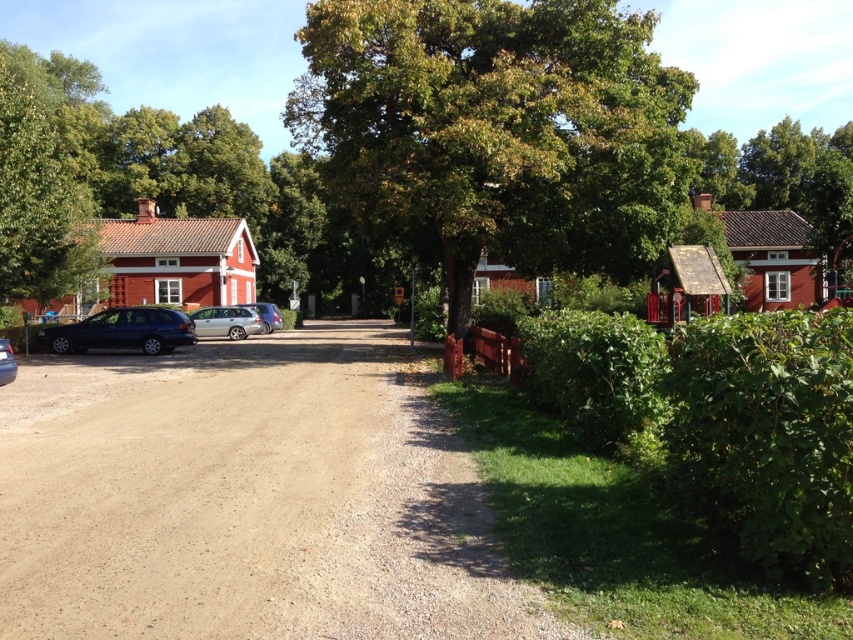
You are a delivery driver trying to park your satin silver car at center on the brown gravel dirt track at lower left. Based on the scene, will the car fit on the track?

The brown gravel dirt track at lower left is shorter than the satin silver car at center, so the car will not fit on the track.

You are a delivery driver with a truck that is 3 meters long. You need to turn your truck around on the road in this scene. Can you fit your truck in the space between the brown gravel dirt track at lower left and the matte black car at left?

The space between the brown gravel dirt track at lower left and the matte black car at left is 5.67 meters. Since your truck is 3 meters long, you have enough space to turn around as the available space is wider than the truck.

You are standing on the dirt road in the rural scene. There are two points marked on the road. The first point is at coordinates point (335, 394) and the second point is at point (276, 316). Which point is closer to you?

Point (335, 394) is closer to the camera than point (276, 316).